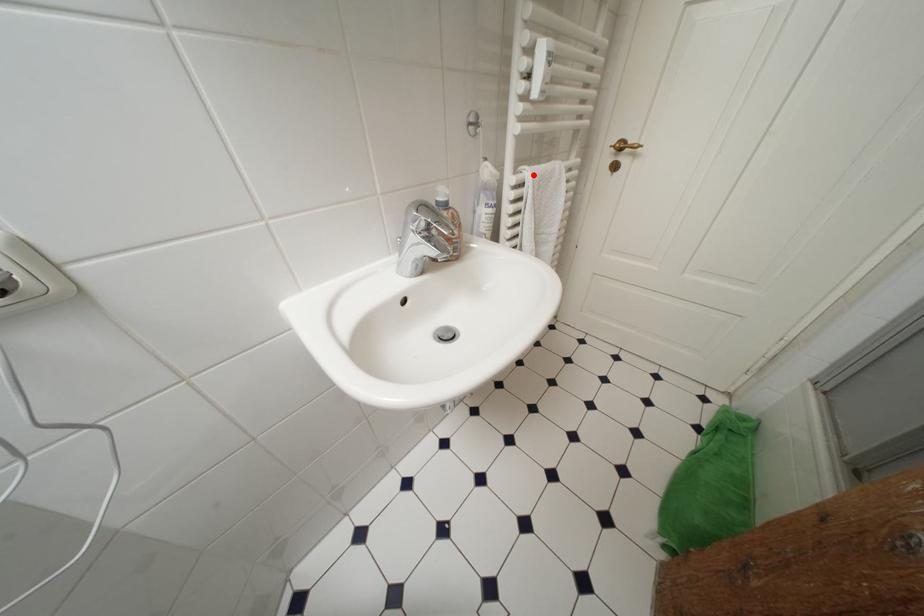
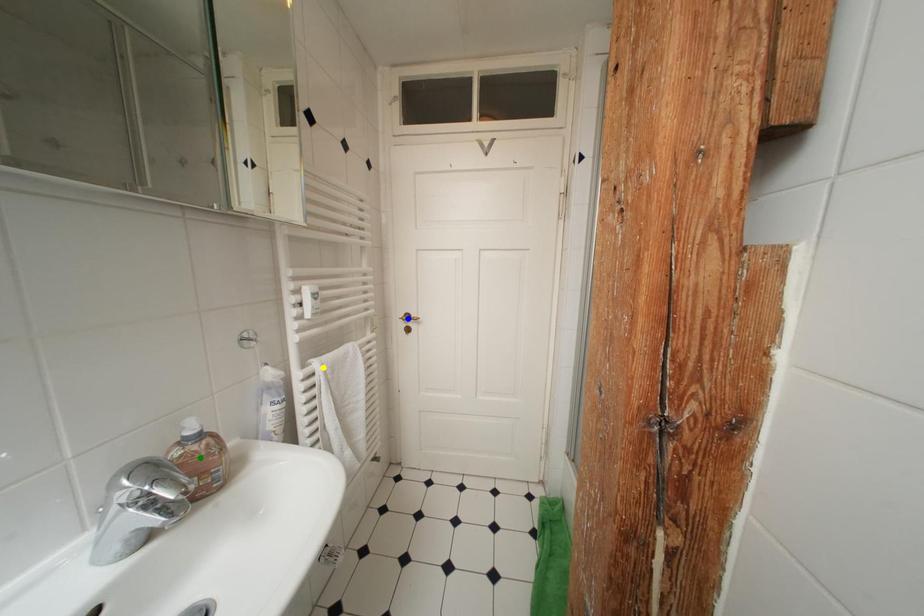
Question: I am providing you with two images of the same scene from different viewpoints. A red point is marked on the first image. You are given multiple points on the second image. Which point in image 2 is actually the same real-world point as the red point in image 1?

Choices:
 (A) blue point
 (B) green point
 (C) yellow point

Answer: (C)